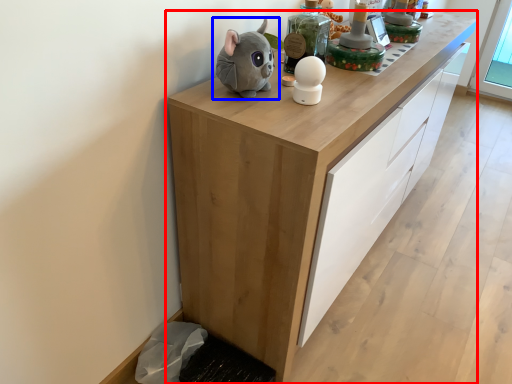
Question: Which object is further to the camera taking this photo, cabinetry (highlighted by a red box) or toy (highlighted by a blue box)?

Choices:
 (A) cabinetry
 (B) toy

Answer: (B)